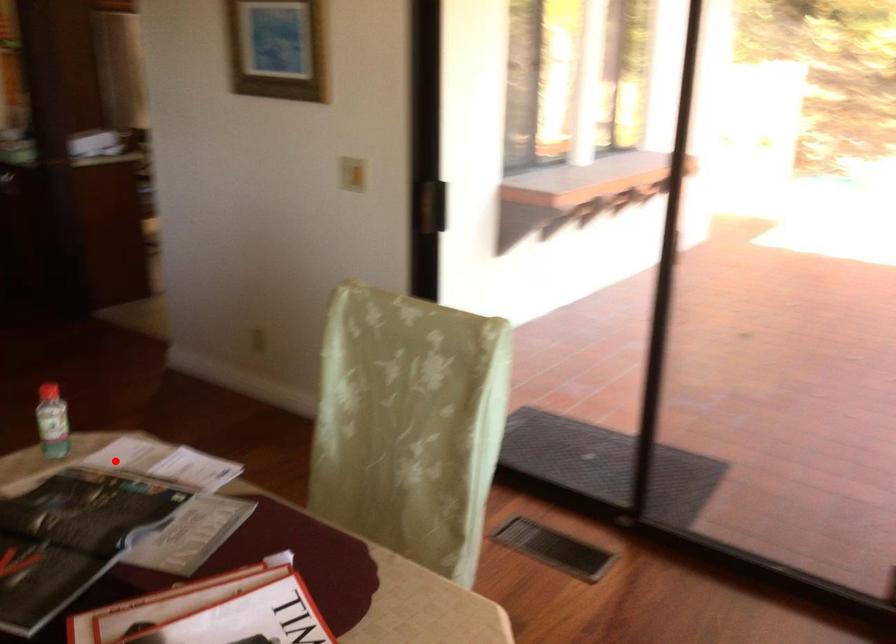
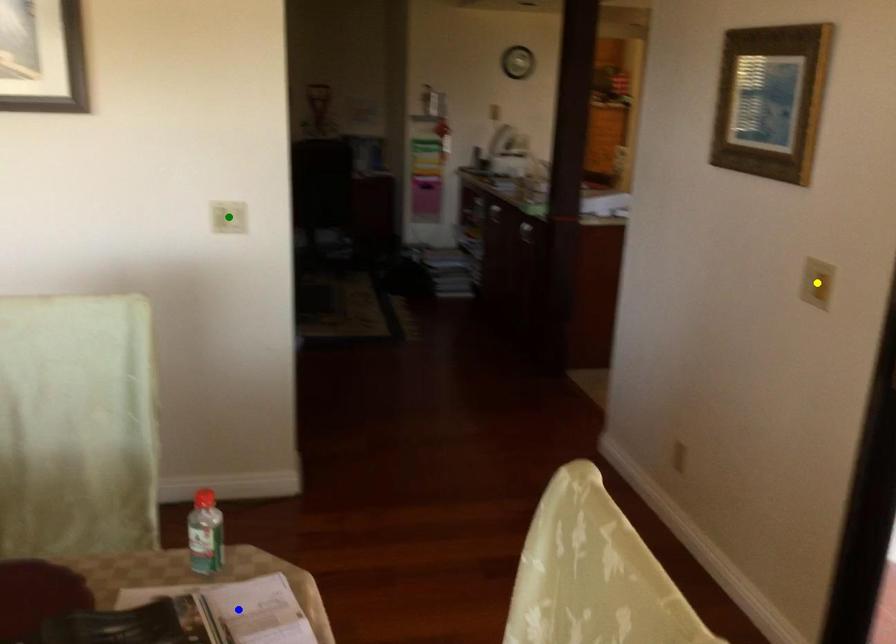
Question: I am providing you with two images of the same scene from different viewpoints. A red point is marked on the first image. You are given multiple points on the second image. Which mark in image 2 goes with the point in image 1?

Choices:
 (A) green point
 (B) blue point
 (C) yellow point

Answer: (B)